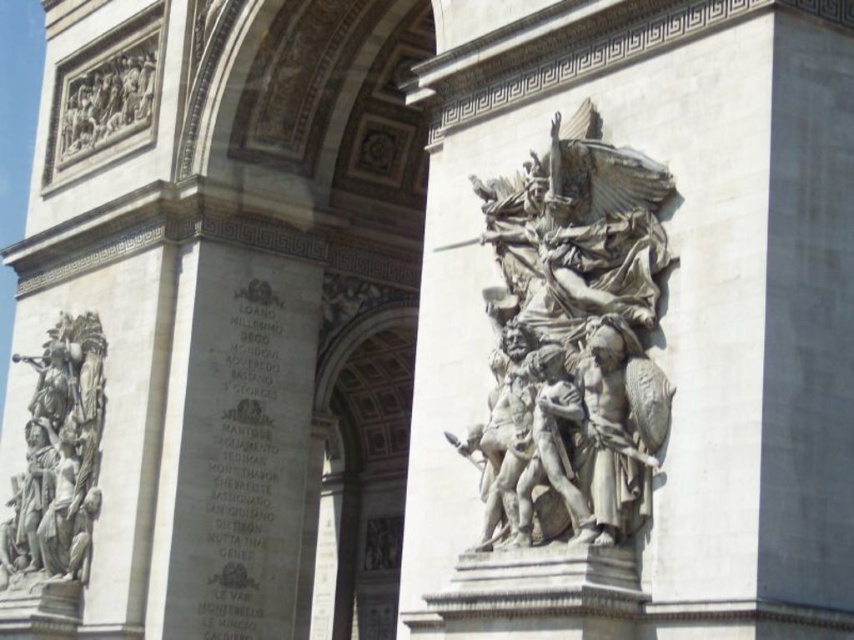
Question: Does stone sculpture at center appear under stone relief figures at left?

Choices:
 (A) no
 (B) yes

Answer: (A)

Question: Which point appears closest to the camera in this image?

Choices:
 (A) (32, 474)
 (B) (586, 451)

Answer: (B)

Question: Which of the following is the closest to the observer?

Choices:
 (A) (104, 120)
 (B) (488, 440)

Answer: (B)

Question: Does stone sculpture at center lie in front of stone relief figures at left?

Choices:
 (A) yes
 (B) no

Answer: (A)

Question: Which of the following is the farthest from the observer?

Choices:
 (A) gray stone bas-relief at upper left
 (B) stone relief figures at left
 (C) stone sculpture at center

Answer: (A)

Question: Does stone sculpture at center appear under gray stone bas-relief at upper left?

Choices:
 (A) yes
 (B) no

Answer: (A)